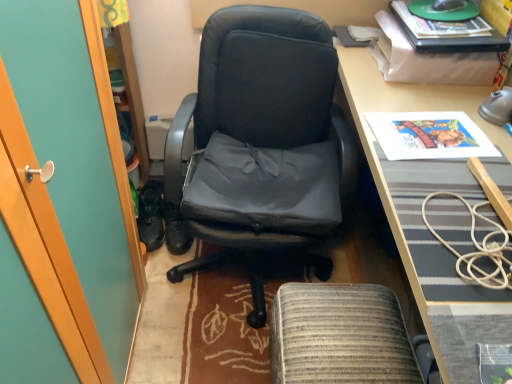
In order to click on empty space that is ontop of woven fabric footrest at lower center (from a real-world perspective) in this screenshot , I will do `click(342, 327)`.